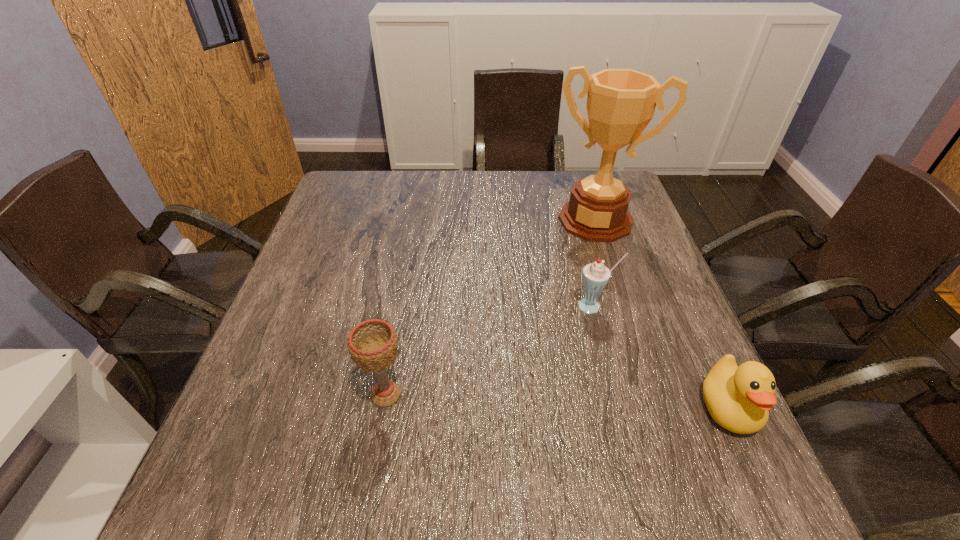
This screenshot has height=540, width=960. I want to click on free spot on the desktop that is between the chalice and the shortest object and is positioned on the straw side of the milkshake, so click(x=555, y=401).

Find the location of a particular element. vacant space on the desktop that is between the chalice and the duck and is positioned on the front-facing side of the award is located at coordinates (523, 400).